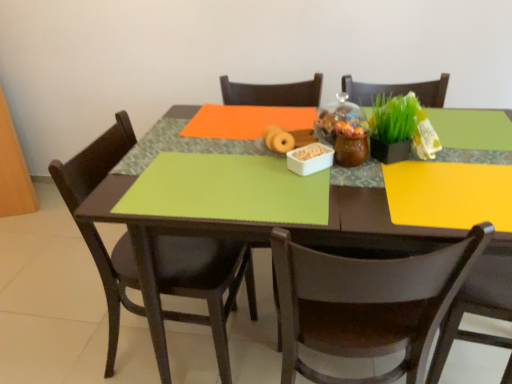
Question: Is matte black chair at left, which is the 2th chair in right-to-left order, wider or thinner than matte brown donut at center?

Choices:
 (A) wide
 (B) thin

Answer: (A)

Question: Looking at the image, does matte black chair at left, which is the 2th chair in right-to-left order, seem bigger or smaller compared to matte brown donut at center?

Choices:
 (A) small
 (B) big

Answer: (B)

Question: Based on their relative distances, which object is nearer to the green matte placemat at center?

Choices:
 (A) green matte table at center
 (B) matte brown donut at center
 (C) matte black chair at left, which ranks as the first chair in left-to-right order
 (D) brown wooden chair at lower right, the 2th chair from the left

Answer: (A)

Question: Considering the real-world distances, which object is farthest from the matte brown donut at center?

Choices:
 (A) green matte placemat at center
 (B) green matte table at center
 (C) matte black chair at left, which is the 2th chair in right-to-left order
 (D) brown wooden chair at lower right, the 1th chair when ordered from right to left

Answer: (C)